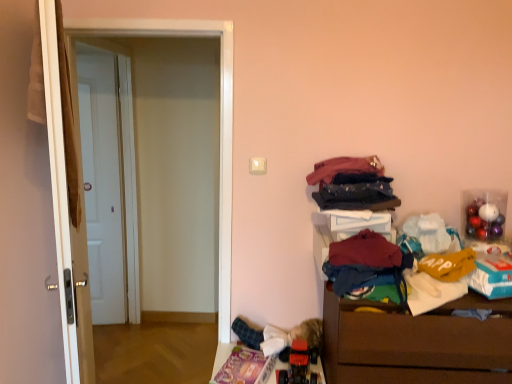
Locate an element on the screen. The width and height of the screenshot is (512, 384). vacant space situated above white matte door at left, which appears as the 1th door when viewed from the left (from a real-world perspective) is located at coordinates (93, 53).